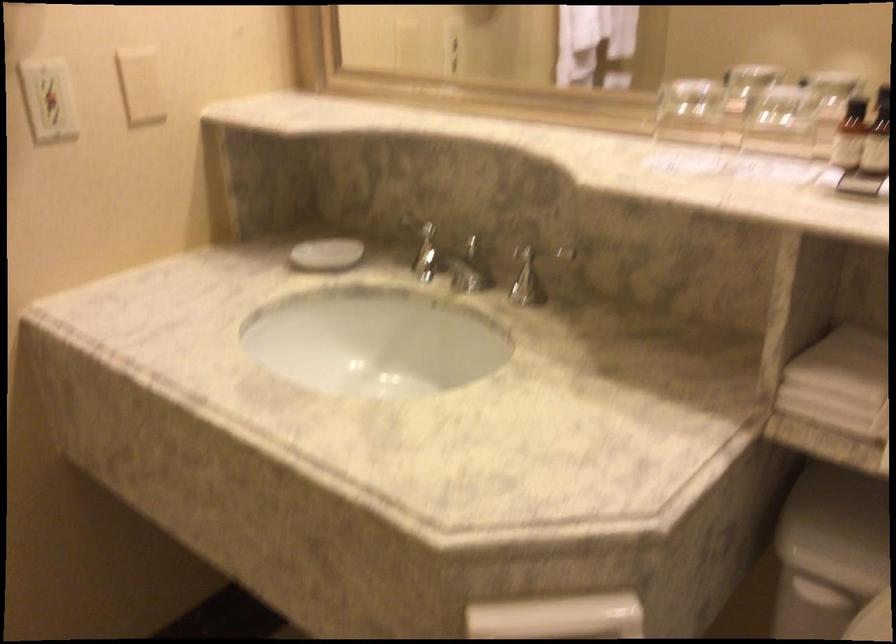
Find the location of a particular element. white light switch is located at coordinates (47, 99).